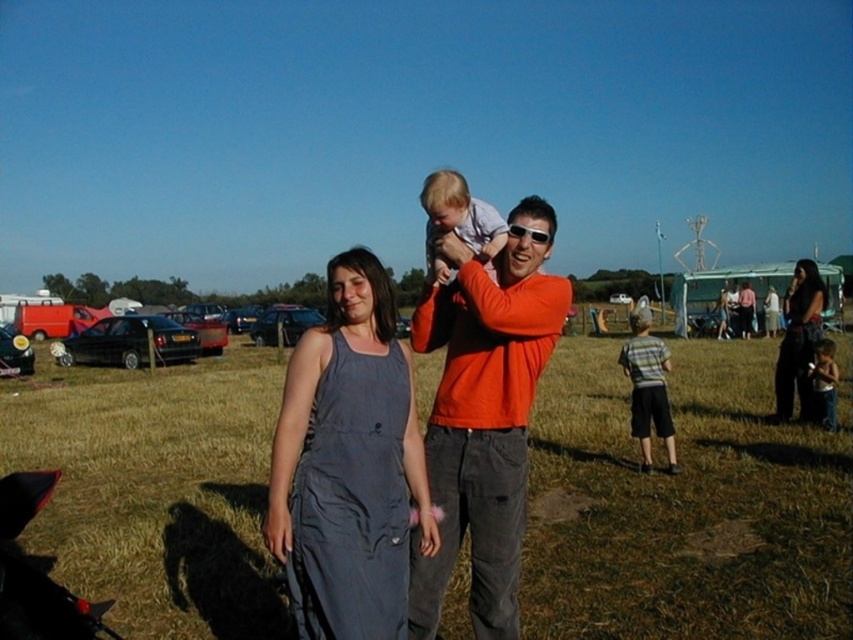
You are a photographer at the fair trying to capture a photo of both the dark gray dress at right and the light brown fabric baby at lower right. Which object should you focus on first if you want to ensure both are in the frame?

The dark gray dress at right is taller than the light brown fabric baby at lower right, so you should focus on the dark gray dress at right first to ensure both are in the frame.

You are a photographer at the fair and need to position two subjects for a photo. The subjects are the striped cotton shirt at lower right and the orange cotton shirt at right. Based on their positions, which shirt should be placed on the left side of the photo to maintain their original spatial relationship?

The striped cotton shirt at lower right should be placed on the left side of the photo because it is originally positioned to the left of the orange cotton shirt at right.

You are a photographer trying to capture a clear shot of the dark gray dress at right and the light brown fabric baby at lower right. Which object is closer to the camera?

The dark gray dress at right is closer to the camera because it is positioned over the light brown fabric baby at lower right, indicating it is in front.